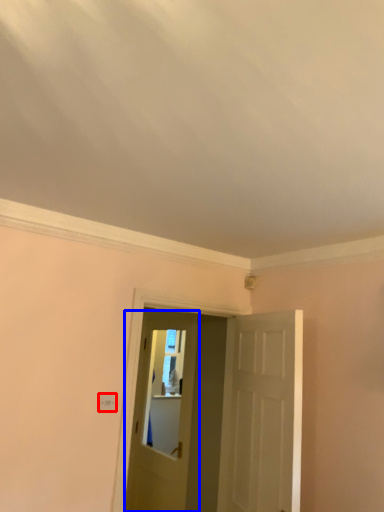
Question: Which object appears closest to the camera in this image, light switch (highlighted by a red box) or door (highlighted by a blue box)?

Choices:
 (A) light switch
 (B) door

Answer: (A)